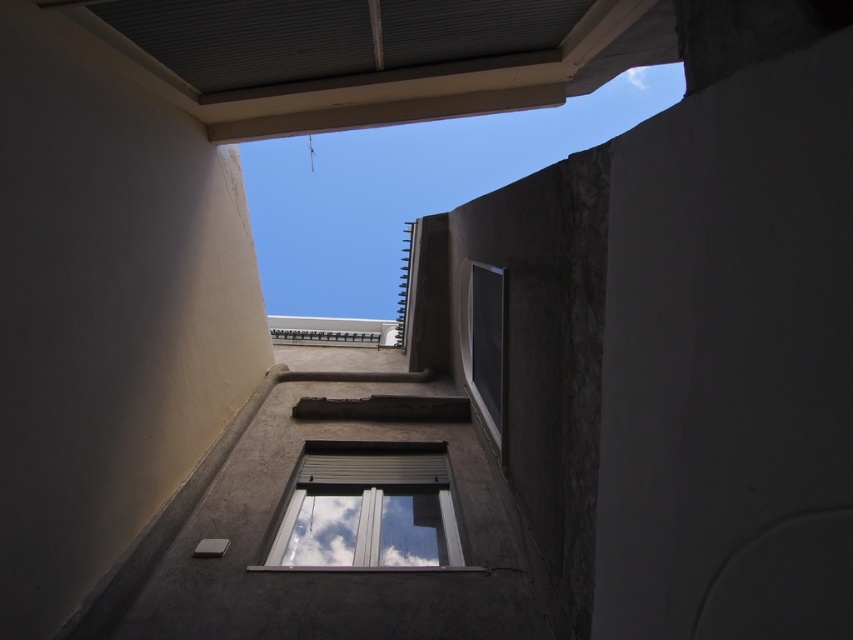
From the picture: Which of these two, matte glass window at center or white fluffy cloud at upper center, stands taller?

With more height is white fluffy cloud at upper center.

Between matte glass window at center and white fluffy cloud at upper center, which one appears on the right side from the viewer's perspective?

From the viewer's perspective, white fluffy cloud at upper center appears more on the right side.

Locate an element on the screen. matte glass window at center is located at coordinates (483, 342).

Does white plastic window at center appear on the left side of matte glass window at center?

Indeed, white plastic window at center is positioned on the left side of matte glass window at center.

Is point (422, 484) in front of point (471, 276)?

Yes.

This screenshot has width=853, height=640. Find the location of `white plastic window at center`. white plastic window at center is located at coordinates (369, 508).

Does white plastic window at center appear on the right side of white fluffy cloud at upper center?

No, white plastic window at center is not to the right of white fluffy cloud at upper center.

Is white plastic window at center smaller than white fluffy cloud at upper center?

Yes, white plastic window at center is smaller than white fluffy cloud at upper center.

Identify the location of white plastic window at center. (369, 508).

At what (x,y) coordinates should I click in order to perform the action: click on white plastic window at center. Please return your answer as a coordinate pair (x, y). The image size is (853, 640). Looking at the image, I should click on (369, 508).